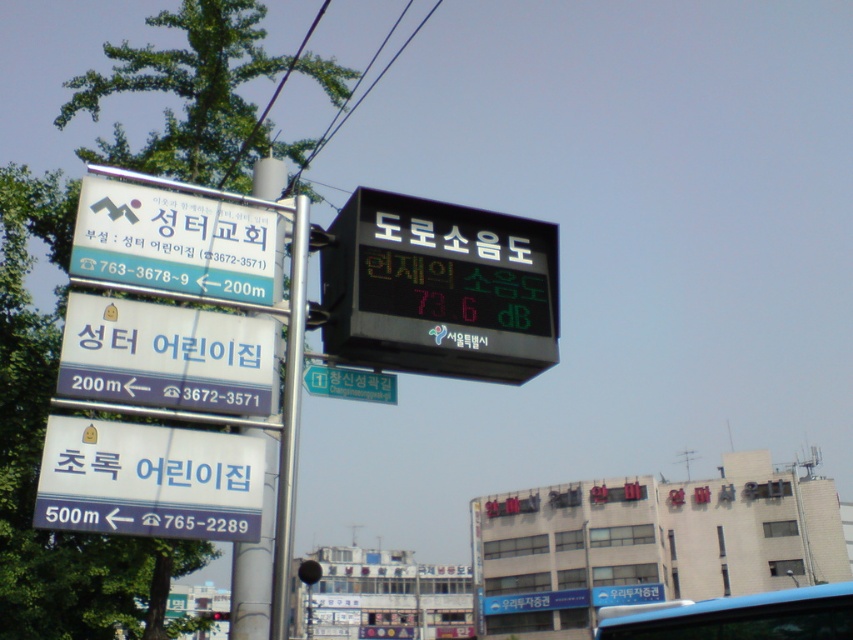
Question: Which is farther from the green plastic street sign at center?

Choices:
 (A) white plastic sign at lower left
 (B) white plastic sign at left
 (C) black electronic display at upper center

Answer: (A)

Question: Does black electronic display at upper center come in front of white plastic sign at lower left?

Choices:
 (A) no
 (B) yes

Answer: (A)

Question: Which point is farther to the camera?

Choices:
 (A) (386, 388)
 (B) (146, 241)
 (C) (442, 216)
 (D) (247, 317)

Answer: (C)

Question: Does white plastic sign at lower left appear under green plastic street sign at center?

Choices:
 (A) no
 (B) yes

Answer: (B)

Question: Which object is positioned farthest from the white plastic sign at lower left?

Choices:
 (A) green plastic street sign at center
 (B) black electronic display at upper center

Answer: (B)

Question: Is white plastic sign at lower left to the left of green plastic street sign at center from the viewer's perspective?

Choices:
 (A) no
 (B) yes

Answer: (B)